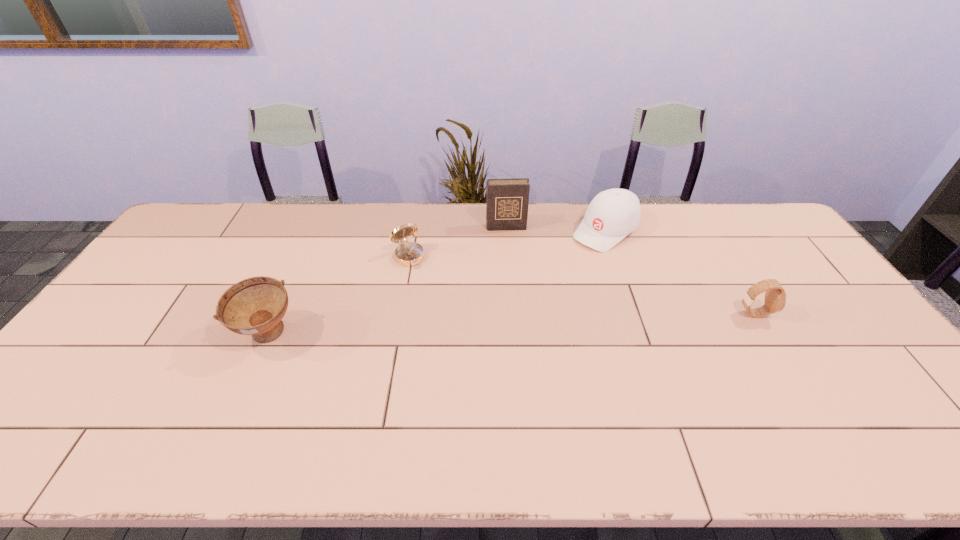
Where is `vacant space that is in between the leftmost object and the second object from right to left`? Image resolution: width=960 pixels, height=540 pixels. vacant space that is in between the leftmost object and the second object from right to left is located at coordinates (437, 283).

Locate an element on the screen. The image size is (960, 540). vacant area that lies between the watch and the fourth object from left to right is located at coordinates (679, 272).

At what (x,y) coordinates should I click in order to perform the action: click on vacant space that is in between the leftmost object and the fourth object from left to right. Please return your answer as a coordinate pair (x, y). Looking at the image, I should click on (437, 283).

Where is `vacant space that is in between the leftmost object and the second object from left to right`? vacant space that is in between the leftmost object and the second object from left to right is located at coordinates (338, 296).

This screenshot has width=960, height=540. Identify the location of vacant area that lies between the third object from right to left and the compass. (457, 242).

Identify the location of object that is the fourth closest to the watch. (255, 306).

In order to click on object identified as the third closest to the leftmost object in this screenshot , I will do `click(613, 214)`.

Where is `free space that satisfies the following two spatial constraints: 1. on the back side of the leftmost object; 2. on the face of the rightmost object`? This screenshot has height=540, width=960. free space that satisfies the following two spatial constraints: 1. on the back side of the leftmost object; 2. on the face of the rightmost object is located at coordinates (278, 314).

Where is `free space in the image that satisfies the following two spatial constraints: 1. on the front side of the second object from left to right; 2. on the face of the watch`? This screenshot has height=540, width=960. free space in the image that satisfies the following two spatial constraints: 1. on the front side of the second object from left to right; 2. on the face of the watch is located at coordinates (398, 314).